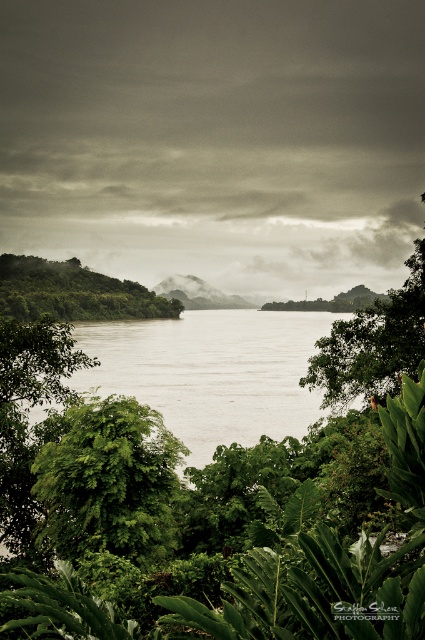
Question: Which object is the closest to the green leafy tree at lower left?

Choices:
 (A) green leafy trees at left
 (B) green leafy tree at center-right
 (C) gray water at center

Answer: (B)

Question: Is gray water at center thinner than green leafy trees at left?

Choices:
 (A) yes
 (B) no

Answer: (B)

Question: Is green leafy tree at lower left positioned at the back of green leafy tree at center-right?

Choices:
 (A) yes
 (B) no

Answer: (B)

Question: Can you confirm if gray water at center is wider than green leafy trees at left?

Choices:
 (A) yes
 (B) no

Answer: (A)

Question: Which point appears farthest from the camera in this image?

Choices:
 (A) coord(382,342)
 (B) coord(65,444)
 (C) coord(186,371)

Answer: (C)

Question: Which point is closer to the camera?

Choices:
 (A) (127, 282)
 (B) (90, 340)
 (C) (153, 428)

Answer: (C)